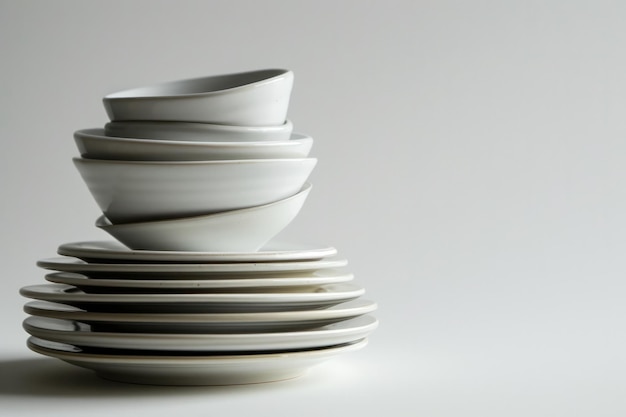
I want to click on plate, so click(x=295, y=358), click(x=316, y=340), click(x=326, y=315), click(x=305, y=300), click(x=317, y=279), click(x=336, y=265), click(x=315, y=255).